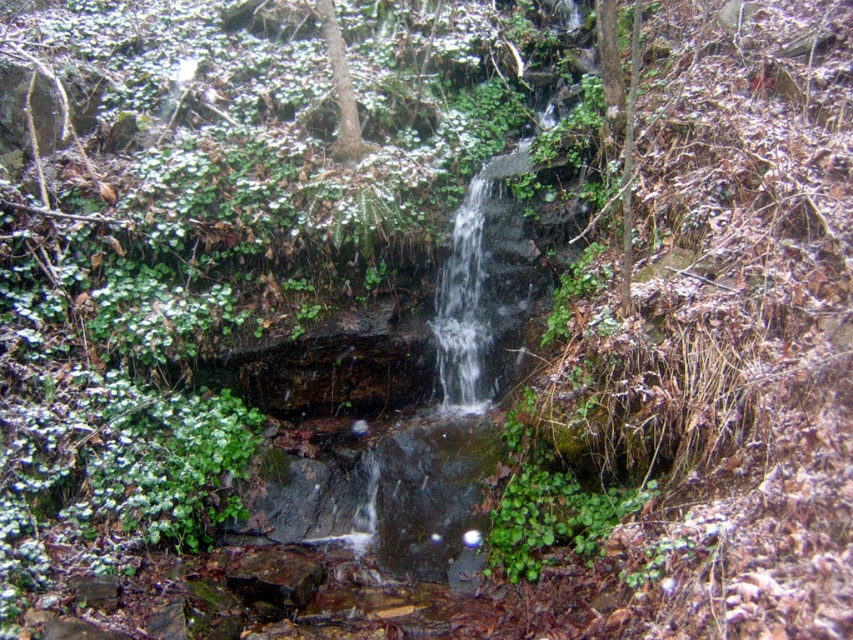
You are an environmental scientist studying the trees in this area. You need to determine which tree has a wider trunk. Based on the image, which tree has a larger trunk between the brown rough tree at center and the green leafy tree at center?

The brown rough tree at center has a larger trunk than the green leafy tree at center according to the description.

You are standing at the base of the waterfall and want to walk between the brown rough tree at center and the green leafy tree at center. The path between them is 1.2 meters wide. Can you pass through comfortably?

The path between the brown rough tree at center and the green leafy tree at center is 1.2 meters wide. Since the average comfortable walking width for a person is about 0.7 to 1 meter, the path is wider than needed, so yes, you can pass through comfortably.

In the scene shown: You are standing at the base of the waterfall in the image and want to reach a specific point. If you move forward from where you are, which of the two points, point (335, 51) or point (619, 92), will you encounter first?

You will encounter point (619, 92) first because it is closer to your starting position at the base of the waterfall compared to point (335, 51), which is located behind it.